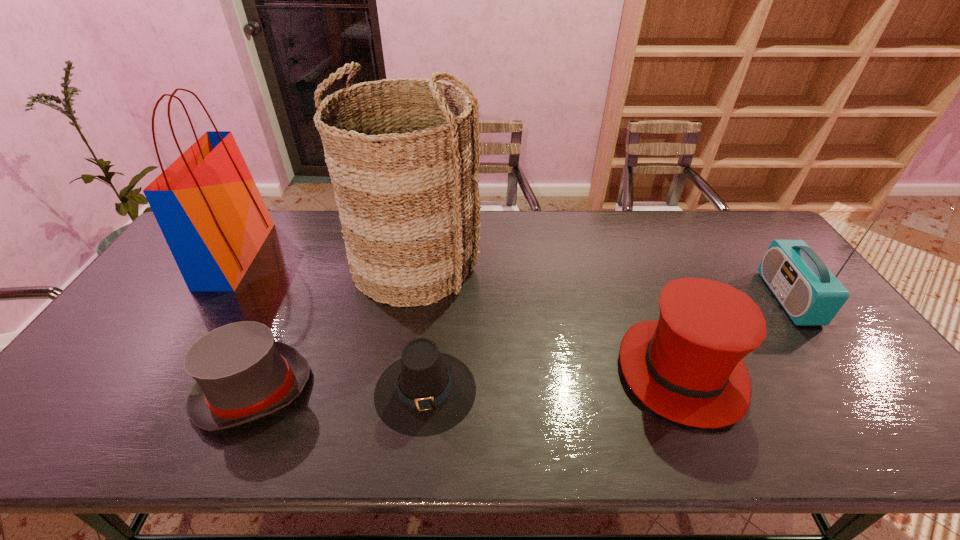
Identify the location of vacant space that satisfies the following two spatial constraints: 1. on the handle side of the leftmost object; 2. on the left side of the basket. This screenshot has width=960, height=540. (230, 264).

The width and height of the screenshot is (960, 540). In order to click on vacant space that satisfies the following two spatial constraints: 1. on the front side of the basket; 2. on the right side of the tallest hat in this screenshot , I will do `click(397, 371)`.

This screenshot has width=960, height=540. I want to click on free spot that satisfies the following two spatial constraints: 1. on the handle side of the leftmost hat; 2. on the left side of the shopping bag, so click(x=148, y=390).

At what (x,y) coordinates should I click in order to perform the action: click on free space in the image that satisfies the following two spatial constraints: 1. on the handle side of the shopping bag; 2. on the left side of the fourth tallest object. Please return your answer as a coordinate pair (x, y). This screenshot has height=540, width=960. Looking at the image, I should click on (160, 371).